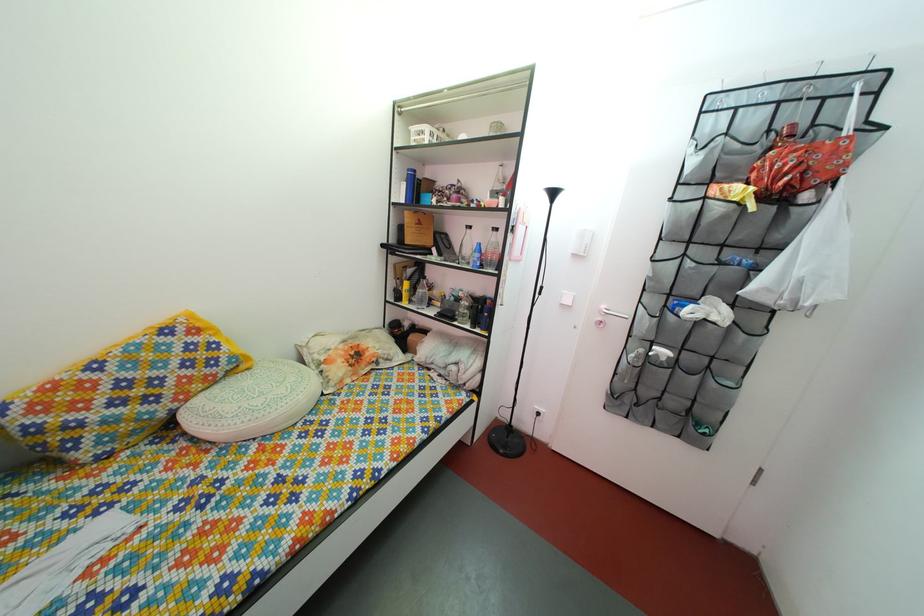
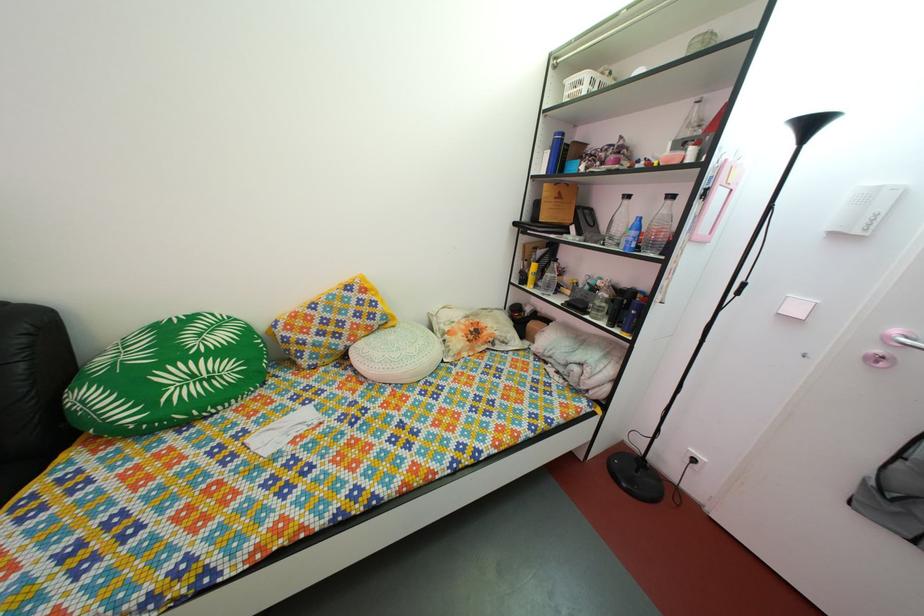
Find the pixel in the second image that matches [414,302] in the first image.

(540, 286)